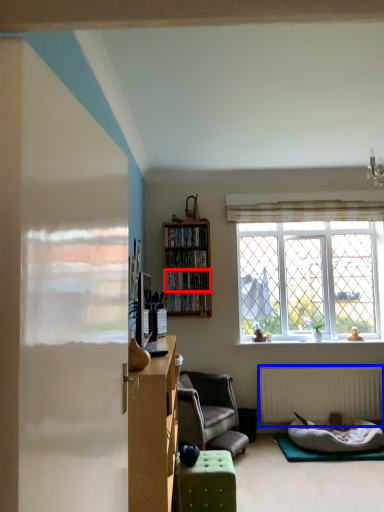
Question: Among these objects, which one is nearest to the camera, shelf (highlighted by a red box) or radiator (highlighted by a blue box)?

Choices:
 (A) shelf
 (B) radiator

Answer: (B)